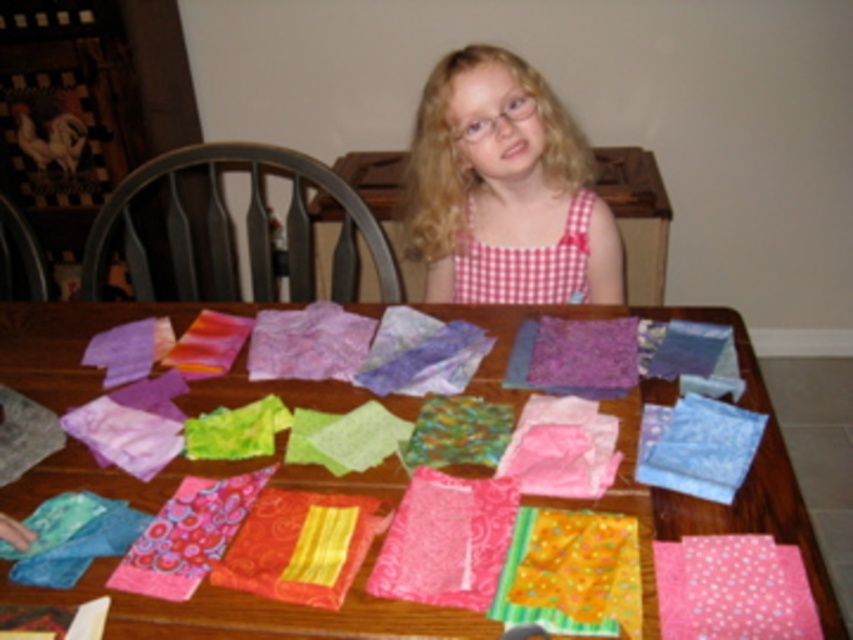
You are a craft assistant and need to retrieve the blue satin fabric at center and the red checkered fabric at upper center. Which fabric should you reach for first to avoid blocking the other?

You should reach for the blue satin fabric at center first since it is in front of the red checkered fabric at upper center, so grabbing it first will prevent blocking access to the one behind.

You are a visitor observing the girl crafting. You notice the pink checkered dress at center and the pink polka dot fabric at lower right. Which object is closer to you?

The pink checkered dress at center is closer to you because the pink polka dot fabric at lower right is behind it.

You are a delivery robot that is 0.5 meters wide. You need to deliver a package to the pink checkered dress at center. The path from your current position to the dress is clear except for the table. Can you reach the dress without moving the table?

The pink checkered dress at center and viewer are 1.31 meters apart from each other. Since the delivery robot is 0.5 meters wide and the path is clear except for the table, the robot can navigate to the dress without needing to move the table as the distance allows passage.